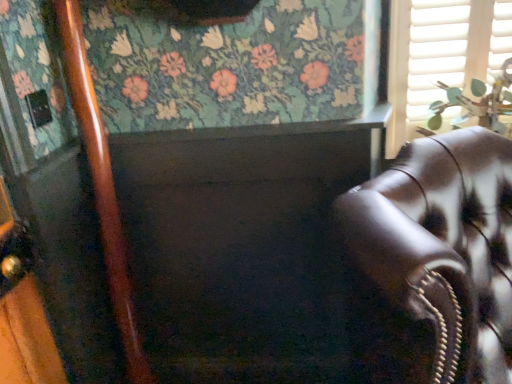
Question: Is white matte shutter at upper right spatially inside leather couch at right, or outside of it?

Choices:
 (A) outside
 (B) inside

Answer: (A)

Question: Based on their positions, is white matte shutter at upper right located to the left or right of leather couch at right?

Choices:
 (A) right
 (B) left

Answer: (A)

Question: Estimate the real-world distances between objects in this image. Which object is farther from the green leafy plant at upper right?

Choices:
 (A) leather couch at right
 (B) white matte shutter at upper right

Answer: (A)

Question: Which of these objects is positioned farthest from the white matte shutter at upper right?

Choices:
 (A) green leafy plant at upper right
 (B) leather couch at right

Answer: (B)